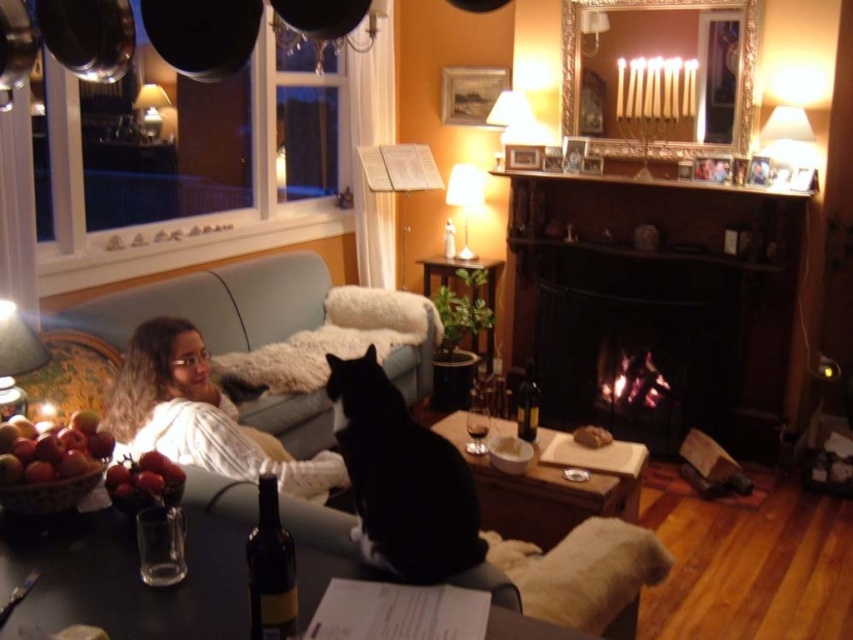
Question: Is wooden cutting board at center behind matte glass bottle at lower left?

Choices:
 (A) yes
 (B) no

Answer: (A)

Question: Is black metal fireplace at center positioned at the back of wooden cutting board at center?

Choices:
 (A) yes
 (B) no

Answer: (A)

Question: Which object is closer to the camera taking this photo?

Choices:
 (A) wooden cutting board at center
 (B) black fur cat at center

Answer: (B)

Question: Which point is closer to the camera?

Choices:
 (A) dark wood fireplace at center
 (B) black metal fireplace at center
 (C) fuzzy white blanket at lower center
 (D) light blue fabric couch at center

Answer: (C)

Question: Considering the real-world distances, which object is farthest from the shiny red grapes at lower left?

Choices:
 (A) matte glass bottle at lower left
 (B) fuzzy white blanket at lower center
 (C) black fur cat at center
 (D) white soft sweater at center

Answer: (B)

Question: Does translucent glass table at lower center have a larger size compared to fuzzy white blanket at lower center?

Choices:
 (A) no
 (B) yes

Answer: (A)